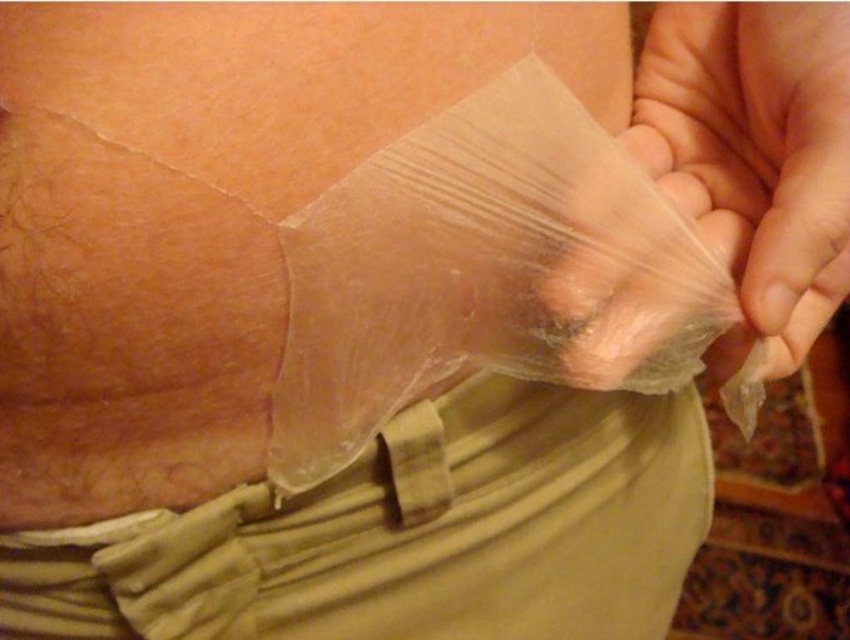
You are a physical therapist observing a patient recovering from surgery. The patient has two items in their vicinity. One is the transparent plastic at lower center and the other is the transparent plastic bag at lower right. Based on their heights, which item is more likely to be the bandage cover they just removed?

The transparent plastic at lower center has a lesser height compared to the transparent plastic bag at lower right, so the transparent plastic at lower center is more likely to be the bandage cover they just removed since it is smaller in height.

You are a nurse assessing the materials used for wound care. You have two options in the image, the transparent plastic at lower center and the transparent plastic bag at lower right. Which one is more suitable for covering a wound based on their sizes?

The transparent plastic at lower center might be wider than the transparent plastic bag at lower right, making it more suitable for covering a wound since it can provide better coverage.